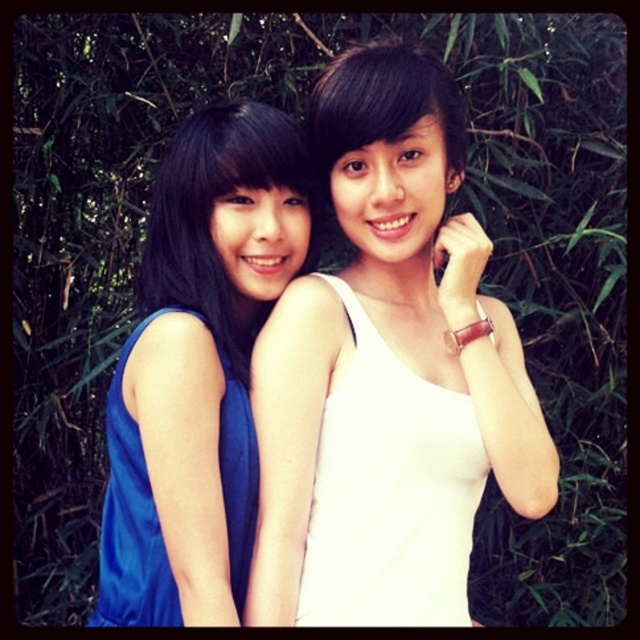
Question: Can you confirm if white matte tank top at center is bigger than blue satin dress at left?

Choices:
 (A) no
 (B) yes

Answer: (B)

Question: Is white matte tank top at center positioned at the back of matte blue dress at left?

Choices:
 (A) no
 (B) yes

Answer: (A)

Question: Which object is closer to the camera taking this photo?

Choices:
 (A) white matte tank top at center
 (B) white satin dress at center
 (C) matte blue dress at left
 (D) blue satin dress at left

Answer: (D)

Question: Which of these objects is positioned closest to the white satin dress at center?

Choices:
 (A) matte blue dress at left
 (B) blue satin dress at left

Answer: (B)

Question: Is blue satin dress at left positioned in front of matte blue dress at left?

Choices:
 (A) yes
 (B) no

Answer: (A)

Question: Which of the following is the farthest from the observer?

Choices:
 (A) (280, 620)
 (B) (198, 156)

Answer: (B)